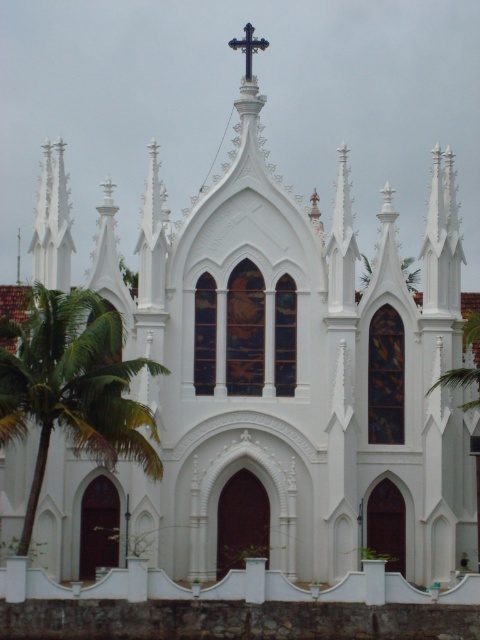
Question: Which of the following is the closest to the observer?

Choices:
 (A) green leafy palm tree at left
 (B) black metal cross at upper center
 (C) green leafy palm tree at right

Answer: (A)

Question: Does green leafy palm tree at left lie in front of black metal cross at upper center?

Choices:
 (A) yes
 (B) no

Answer: (A)

Question: Is green leafy palm tree at left thinner than green leafy palm tree at right?

Choices:
 (A) no
 (B) yes

Answer: (A)

Question: Which of the following is the farthest from the observer?

Choices:
 (A) (244, 44)
 (B) (479, 400)

Answer: (A)

Question: Which point appears farthest from the camera in this image?

Choices:
 (A) (34, 296)
 (B) (465, 301)
 (C) (248, 29)

Answer: (C)

Question: Is green leafy palm tree at right below black metal cross at upper center?

Choices:
 (A) no
 (B) yes

Answer: (B)